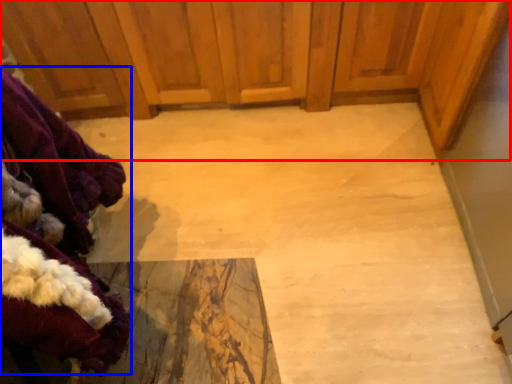
Question: Which of the following is the farthest to the observer, dresser (highlighted by a red box) or clothing (highlighted by a blue box)?

Choices:
 (A) dresser
 (B) clothing

Answer: (A)